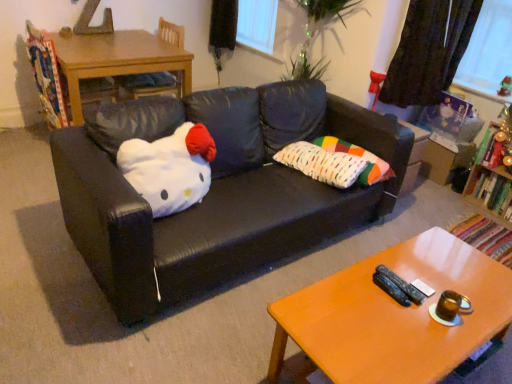
Image resolution: width=512 pixels, height=384 pixels. Find the location of `vacant point to the left of wooden bookshelf at right`. vacant point to the left of wooden bookshelf at right is located at coordinates (453, 204).